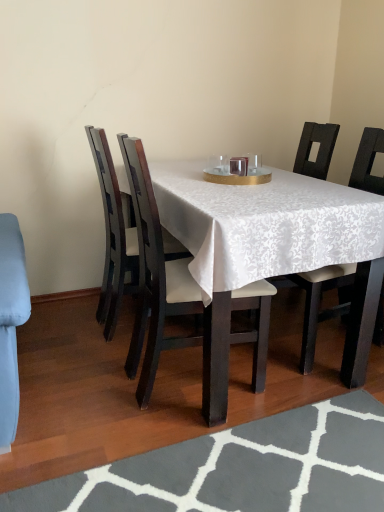
Identify the location of free location to the left of white fabric-covered chair at center, which is counted as the 3th chair, starting from the right. (78, 386).